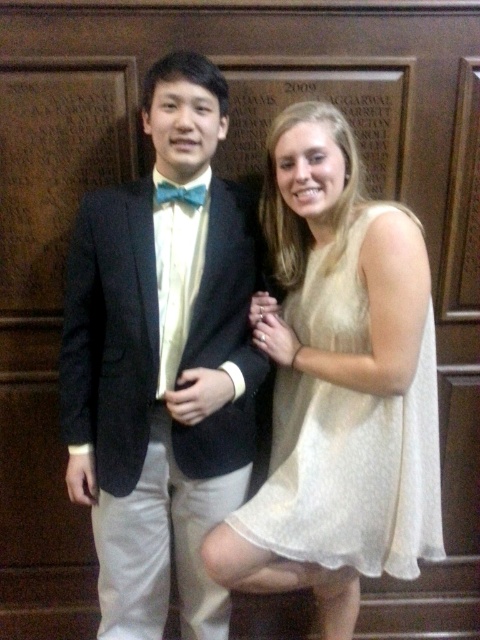
You are a photographer standing 3 meters away from the couple. You want to take a closeup shot of both the matte black suit at center and the white textured dress at center without moving the subjects. Can you fit both into your camera frame that has a width of 30 centimeters?

The matte black suit at center and white textured dress at center are 26.58 centimeters apart from each other. Since the camera frame is 30 centimeters wide, you can fit both into the frame as the distance between them is less than the frame width.

What object is located at the coordinates point (162, 362)?

The point (162, 362) corresponds to the matte black suit at center.

You are standing in front of the image and want to point to the exact center of the matte black suit at center. What are the coordinates of its center position?

The coordinates of the center position of the matte black suit at center are at point (162, 362).